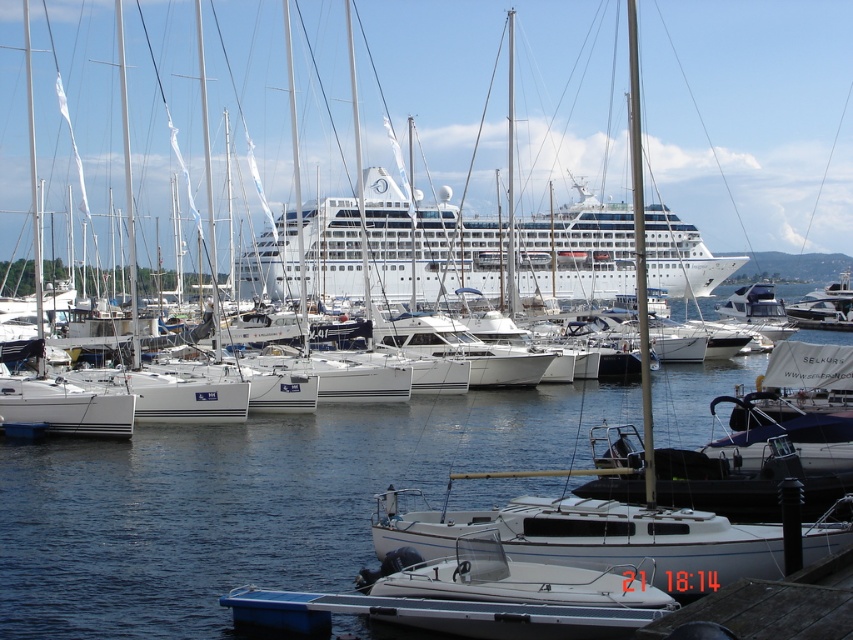
Based on the photo, you are a photographer planning to take a photo of the blue water at center and the white matte motorboat at center. Based on their positions, which one should you focus on first if you want to capture both in a single shot without moving the camera?

The white matte motorboat at center should be focused on first because the blue water at center is located above it, so adjusting focus from the lower object upwards would ensure both are in frame.

You are standing at the center of the marina and want to locate the white glossy cruise ship at center. According to the coordinates provided, in which direction should you look to find it?

The white glossy cruise ship at center is located at coordinates point (428,244), so you should look slightly to the left and down from the center to find it.

You are standing on the dock and want to take a photo of the white glossy cruise ship at center. If your camera can focus on objects up to 15 meters away, will you be able to capture a clear image?

The white glossy cruise ship at center is 13.76 meters away from the camera, which is within the camera focus range of up to 15 meters. Therefore, the camera can capture a clear image of the white glossy cruise ship at center.